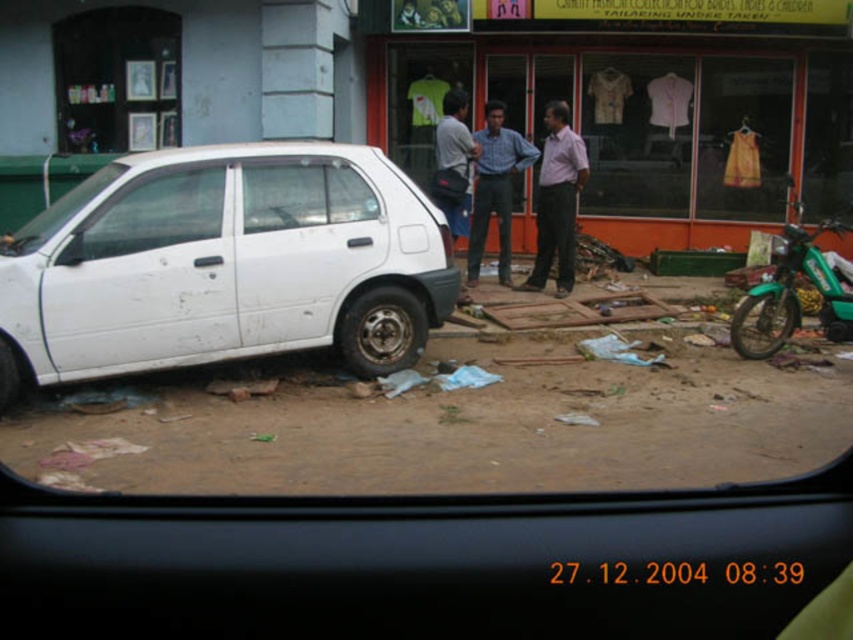
Is pink smooth shirt at center further to the viewer compared to blue shirt at center?

No, it is in front of blue shirt at center.

Who is more forward, (566,280) or (477,189)?

Positioned in front is point (566,280).

The height and width of the screenshot is (640, 853). What are the coordinates of `pink smooth shirt at center` in the screenshot? It's located at click(x=556, y=200).

Based on the photo, does white matte car at left appear over green matte motorcycle at right?

Correct, white matte car at left is located above green matte motorcycle at right.

Does point (106, 192) come closer to viewer compared to point (763, 296)?

Yes, point (106, 192) is in front of point (763, 296).

Locate an element on the screen. This screenshot has height=640, width=853. white matte car at left is located at coordinates (224, 264).

Between white matte car at left and pink smooth shirt at center, which one has more height?

pink smooth shirt at center is taller.

Consider the image. Is white matte car at left thinner than pink smooth shirt at center?

In fact, white matte car at left might be wider than pink smooth shirt at center.

Between point (331, 212) and point (575, 186), which one is positioned behind?

Point (575, 186)

You are a GUI agent. You are given a task and a screenshot of the screen. Output one action in this format:
    pyautogui.click(x=<x>, y=<y>)
    Task: Click on the white matte car at left
    
    Given the screenshot: What is the action you would take?
    pyautogui.click(x=224, y=264)